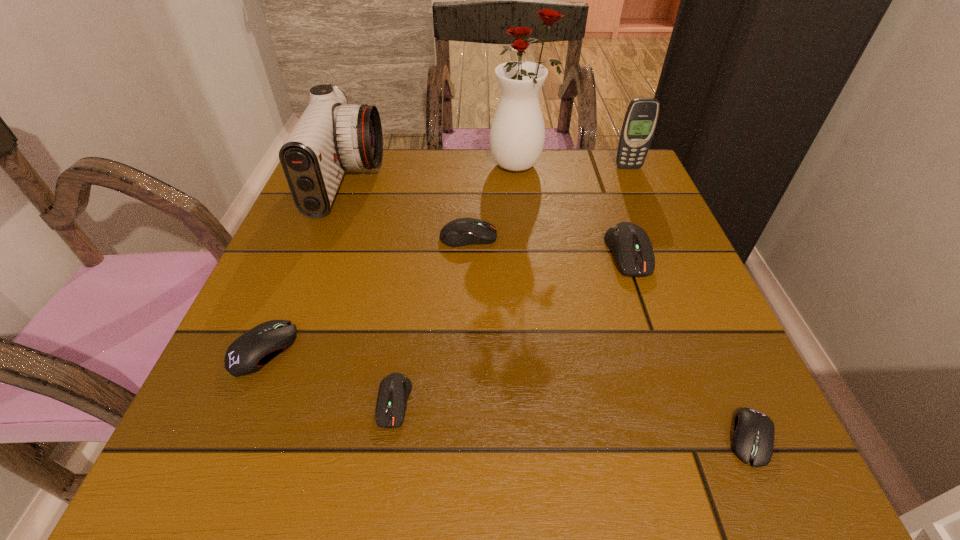
This screenshot has height=540, width=960. In the image, there is a desktop. What are the coordinates of `vacant space at the far edge` in the screenshot? It's located at (560, 188).

What are the coordinates of `blank space at the near edge of the desktop` in the screenshot? It's located at (387, 477).

Identify the location of free region at the left edge of the desktop. The height and width of the screenshot is (540, 960). (337, 273).

Find the location of a particular element. Image resolution: width=960 pixels, height=540 pixels. blank space at the right edge of the desktop is located at coordinates (650, 409).

Image resolution: width=960 pixels, height=540 pixels. In order to click on vacant area at the far left corner of the desktop in this screenshot , I will do `click(365, 174)`.

You are a GUI agent. You are given a task and a screenshot of the screen. Output one action in this format:
    pyautogui.click(x=<x>, y=<y>)
    Task: Click on the vacant space at the far right corner
    
    Given the screenshot: What is the action you would take?
    pyautogui.click(x=603, y=150)

At what (x,y) coordinates should I click in order to perform the action: click on vacant space that's between the bigger black computer equipment and the second smallest dark computer equipment. Please return your answer as a coordinate pair (x, y). Looking at the image, I should click on (366, 293).

Where is `free space between the nearer black computer equipment and the vase`? free space between the nearer black computer equipment and the vase is located at coordinates click(x=636, y=301).

This screenshot has height=540, width=960. What are the coordinates of `empty location between the sixth object from right to left and the tallest object` in the screenshot? It's located at (457, 284).

Locate an element on the screen. The image size is (960, 540). free point between the left black computer equipment and the rightmost dark computer equipment is located at coordinates (445, 301).